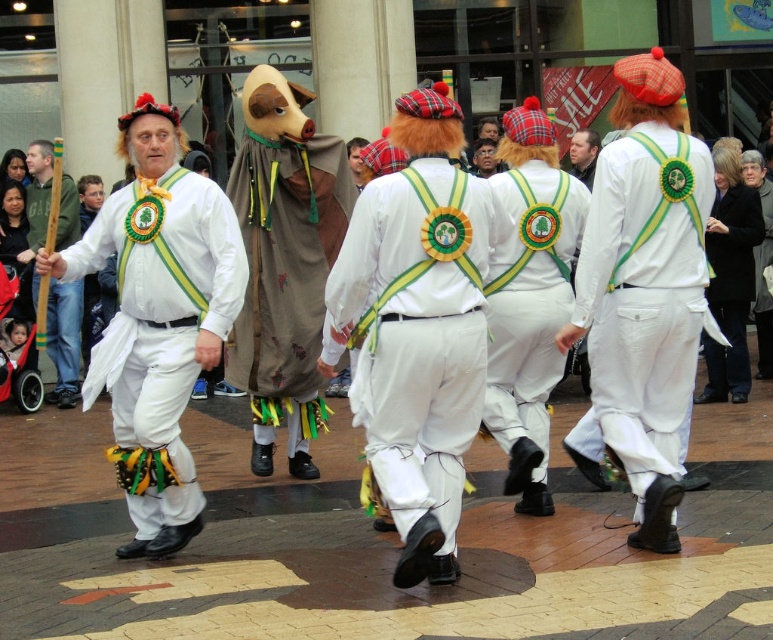
Does white matte/soft fabric pants at left have a lesser width compared to wooden stick at left?

No.

Can you confirm if white matte/soft fabric pants at left is wider than wooden stick at left?

Yes, white matte/soft fabric pants at left is wider than wooden stick at left.

Does point (162, 522) lie in front of point (41, 179)?

Yes, it is.

Locate an element on the screen. The width and height of the screenshot is (773, 640). white matte/soft fabric pants at left is located at coordinates (162, 321).

Is point (162, 406) closer to camera compared to point (552, 202)?

Yes.

Between white matte/soft fabric pants at left and white matte vest at center, which one appears on the left side from the viewer's perspective?

white matte/soft fabric pants at left is more to the left.

Is point (131, 259) less distant than point (506, 188)?

Yes.

This screenshot has height=640, width=773. I want to click on white matte/soft fabric pants at left, so click(162, 321).

Does black wool coat at right appear under white matte pants at center?

Actually, black wool coat at right is above white matte pants at center.

Does black wool coat at right have a larger size compared to white matte pants at center?

Indeed, black wool coat at right has a larger size compared to white matte pants at center.

Between point (746, 376) and point (593, 474), which one is positioned behind?

The point (746, 376) is more distant.

Where is `black wool coat at right`? The width and height of the screenshot is (773, 640). black wool coat at right is located at coordinates (730, 285).